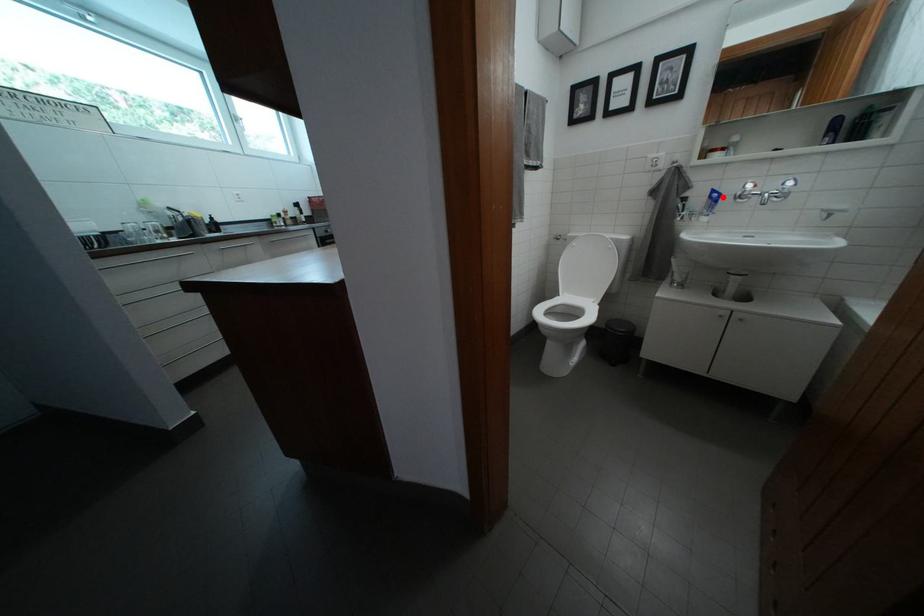
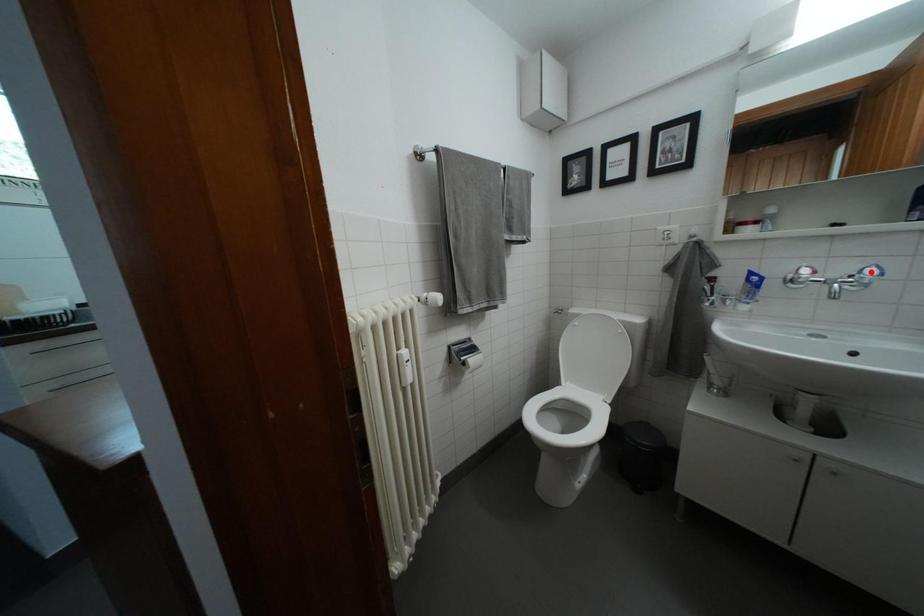
I am providing you with two images of the same scene from different viewpoints. A red point is marked on the first image and another point is marked on the second image. Do the highlighted points in image1 and image2 indicate the same real-world spot?

No